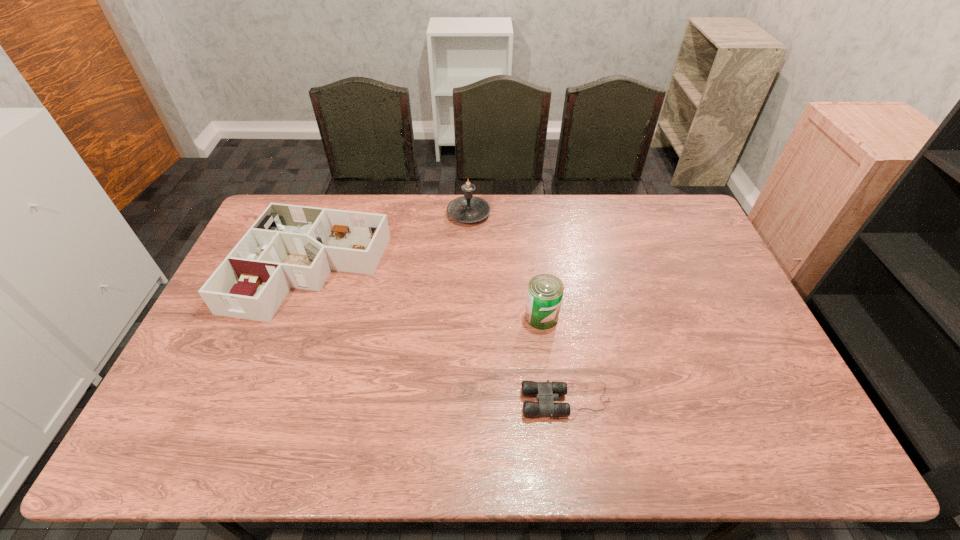
I want to click on the tallest object, so click(468, 208).

The width and height of the screenshot is (960, 540). Find the location of `candle`. candle is located at coordinates (468, 208).

This screenshot has width=960, height=540. Find the location of `can`. can is located at coordinates (545, 292).

Identify the location of the leftmost object. (289, 246).

Where is `the third tallest object`? the third tallest object is located at coordinates (289, 246).

Image resolution: width=960 pixels, height=540 pixels. What are the coordinates of `binoculars` in the screenshot? It's located at (546, 393).

I want to click on the nearest object, so click(546, 393).

The height and width of the screenshot is (540, 960). I want to click on vacant space located on the right of the second object from left to right, so click(x=544, y=214).

The height and width of the screenshot is (540, 960). Find the location of `free space located 0.260m on the front of the third shortest object`. free space located 0.260m on the front of the third shortest object is located at coordinates (554, 414).

Identify the location of vacant space located 0.120m on the back of the leftmost object. This screenshot has width=960, height=540. (335, 205).